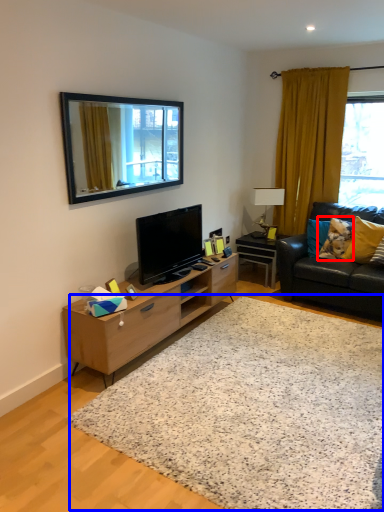
Question: Which object is closer to the camera taking this photo, pillow (highlighted by a red box) or plain (highlighted by a blue box)?

Choices:
 (A) pillow
 (B) plain

Answer: (B)